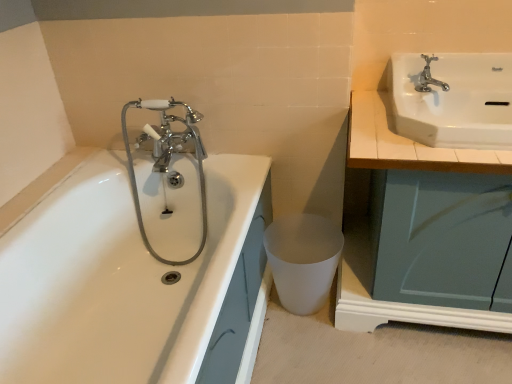
Identify the location of vacant region above white wood countertop at upper right (from a real-world perspective). (448, 110).